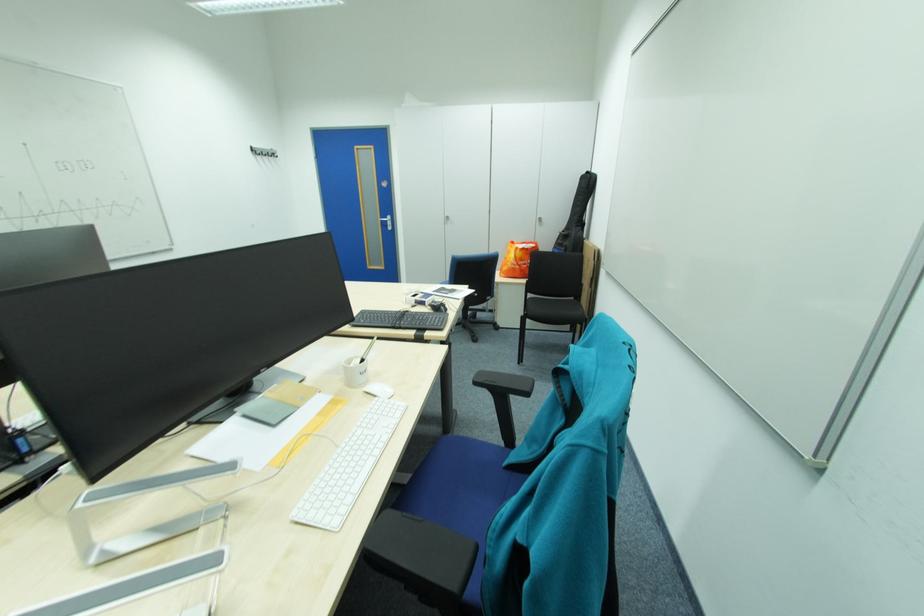
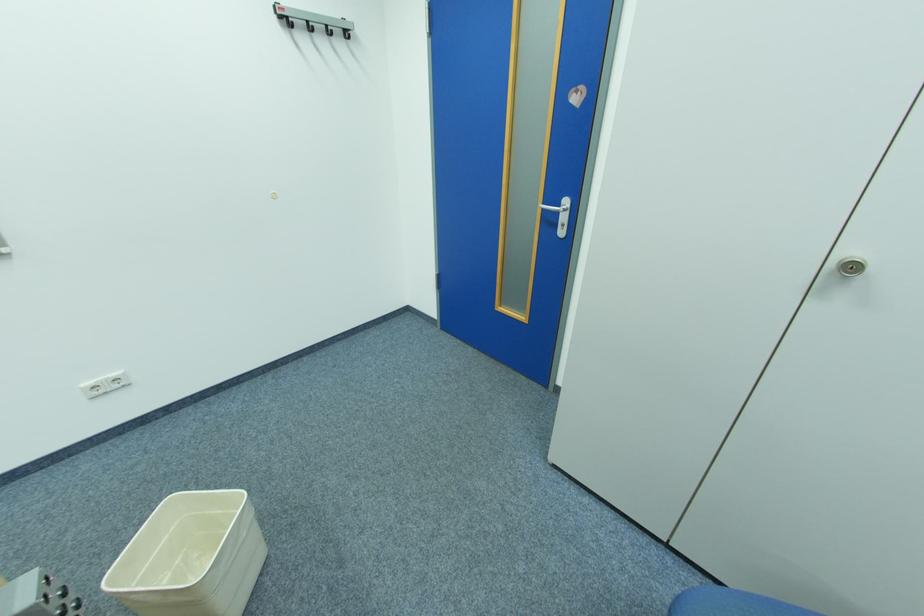
Locate, in the second image, the point that corresponds to pixel 262 153 in the first image.

(290, 25)